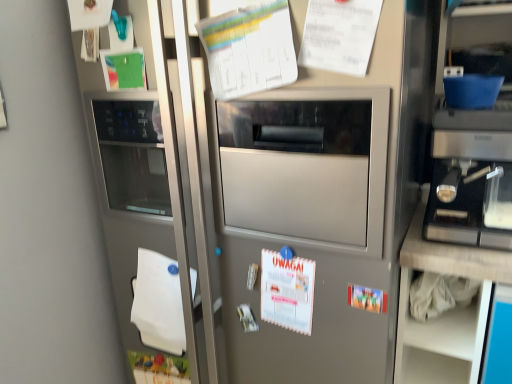
Question: Could you tell me if white paper at upper center, the second poster positioned from the top, is turned towards white paper at upper center, which is the fourth poster in bottom-to-top order?

Choices:
 (A) no
 (B) yes

Answer: (A)

Question: From the image's perspective, is white paper at upper center, the second poster positioned from the top, located beneath white paper at upper center, which is the fourth poster in bottom-to-top order?

Choices:
 (A) no
 (B) yes

Answer: (B)

Question: From a real-world perspective, does white paper at upper center, the second poster positioned from the top, sit lower than white paper at upper center, which is the fourth poster in bottom-to-top order?

Choices:
 (A) yes
 (B) no

Answer: (A)

Question: Is white paper at upper center, the second poster positioned from the top, to the right of white paper at upper center, which is the fourth poster in bottom-to-top order, from the viewer's perspective?

Choices:
 (A) no
 (B) yes

Answer: (A)

Question: Is white paper at upper center, positioned as the 3th poster in bottom-to-top order, located outside white paper at upper center, which is the fourth poster in bottom-to-top order?

Choices:
 (A) yes
 (B) no

Answer: (A)

Question: Is white paper at upper center, the second poster positioned from the top, turned away from white paper at upper center, which appears as the first poster when viewed from the top?

Choices:
 (A) yes
 (B) no

Answer: (B)

Question: From the image's perspective, does white paper at upper center, which appears as the first poster when viewed from the top, appear lower than white paper at lower left?

Choices:
 (A) yes
 (B) no

Answer: (B)

Question: Is white paper at upper center, which appears as the first poster when viewed from the top, positioned with its back to white paper at lower left?

Choices:
 (A) yes
 (B) no

Answer: (B)

Question: Does white paper at upper center, which appears as the first poster when viewed from the top, come behind white paper at lower left?

Choices:
 (A) yes
 (B) no

Answer: (B)

Question: Can you confirm if white paper at upper center, which appears as the first poster when viewed from the top, is smaller than white paper at lower left?

Choices:
 (A) no
 (B) yes

Answer: (A)

Question: From the image's perspective, is white paper at upper center, which is the fourth poster in bottom-to-top order, above white paper at lower left?

Choices:
 (A) yes
 (B) no

Answer: (A)

Question: Is white paper at lower left located within white paper at upper center, which is the fourth poster in bottom-to-top order?

Choices:
 (A) yes
 (B) no

Answer: (B)

Question: Is white paper calendar at center, the 3th poster positioned from the top, in front of white paper at lower left?

Choices:
 (A) no
 (B) yes

Answer: (B)